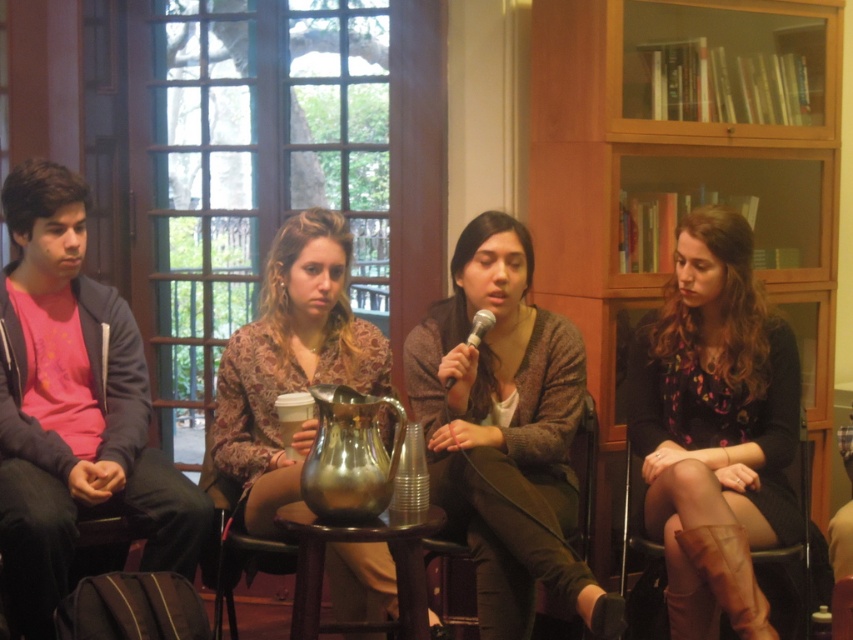
Question: Observing the image, what is the correct spatial positioning of wooden chair at center in reference to metallic silver microphone at center?

Choices:
 (A) right
 (B) left

Answer: (A)

Question: Considering the real-world distances, which object is closest to the knit sweater at center?

Choices:
 (A) floral-patterned dress at center
 (B) shiny metallic pitcher at center
 (C) leather at right
 (D) wooden bookshelf at upper right

Answer: (B)

Question: Is shiny metallic pitcher at center bigger than metallic silver microphone at center?

Choices:
 (A) yes
 (B) no

Answer: (A)

Question: Which point is farther to the camera?

Choices:
 (A) (808, 584)
 (B) (694, 432)
 (C) (758, 243)
 (D) (498, 256)

Answer: (C)

Question: Which point is closer to the camera?

Choices:
 (A) wooden chair at center
 (B) shiny metallic pitcher at center
 (C) leather at right

Answer: (B)

Question: Does shiny metallic pitcher at center lie behind metallic silver microphone at center?

Choices:
 (A) no
 (B) yes

Answer: (A)